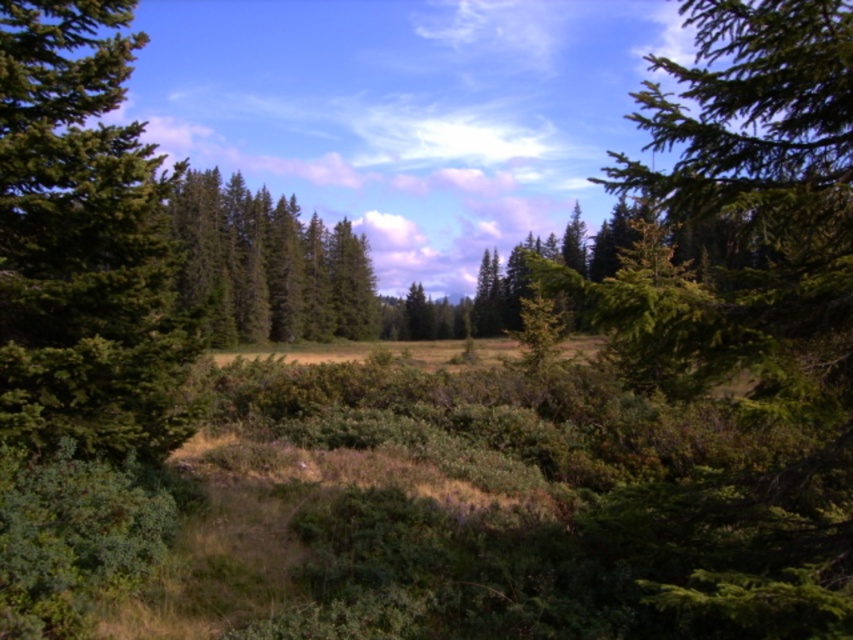
Question: Which point appears closest to the camera in this image?

Choices:
 (A) (120, 64)
 (B) (280, 205)

Answer: (A)

Question: Which point is closer to the camera?

Choices:
 (A) click(186, 227)
 (B) click(126, 397)

Answer: (B)

Question: Is the position of green matte tree at left less distant than that of green matte tree at center?

Choices:
 (A) yes
 (B) no

Answer: (A)

Question: Is green matte tree at left to the left of green matte tree at center from the viewer's perspective?

Choices:
 (A) no
 (B) yes

Answer: (B)

Question: Does green matte tree at left come in front of green matte tree at center?

Choices:
 (A) yes
 (B) no

Answer: (A)